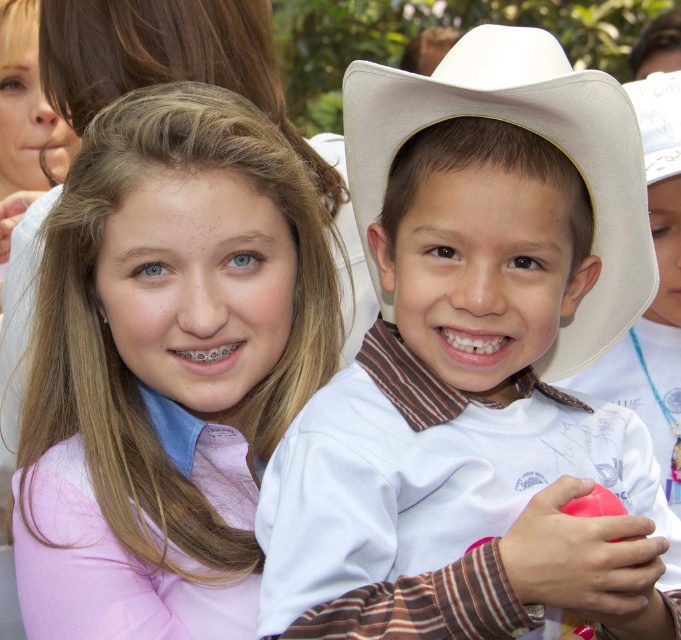
You are a photographer trying to capture a clear shot of both hats. Since both white felt cowboy hat at center and white cotton cowboy hat at center are at the same position, which one would you focus on to ensure the larger hat is in focus?

The white felt cowboy hat at center is larger in size than the white cotton cowboy hat at center, so focusing on the white felt cowboy hat at center will ensure the larger hat is in focus.

You are a photographer trying to capture the two children in the scene. You notice the white matte cowboy hat at upper right and the white cotton cowboy hat at center. Which of these hats is positioned lower in the image?

The white matte cowboy hat at upper right is positioned below the white cotton cowboy hat at center, so it is the lower one.

The image shows two children in an outdoor setting. The child on the left is wearing a light blue shirt and pink jacket, while the child on the right is wearing a white cowboy hat and holding a small red object. Where is the white felt cowboy hat at center located in relation to the children?

The white felt cowboy hat at center is located at point [533,131].